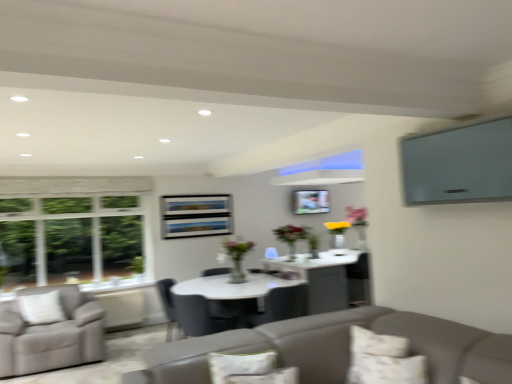
Question: Is fluffy white pillow at lower center, marked as the first pillow in a left-to-right arrangement, wider or thinner than white textured pillow at lower right, the 2th pillow viewed from the left?

Choices:
 (A) thin
 (B) wide

Answer: (A)

Question: Considering the relative positions of fluffy white pillow at lower center, arranged as the 2th pillow when viewed from the right, and white textured pillow at lower right, the 2th pillow viewed from the left, in the image provided, is fluffy white pillow at lower center, arranged as the 2th pillow when viewed from the right, to the left or to the right of white textured pillow at lower right, the 2th pillow viewed from the left,?

Choices:
 (A) right
 (B) left

Answer: (B)

Question: Which object is the farthest from the matte black chair at center, the second chair when ordered from right to left?

Choices:
 (A) fluffy white pillow at lower center, arranged as the 2th pillow when viewed from the right
 (B) white textured pillow at lower right, the 2th pillow viewed from the left
 (C) matte gray chair at center, which ranks as the 1th chair in right-to-left order

Answer: (B)

Question: Which object is positioned farthest from the matte black chair at center, the second chair when ordered from right to left?

Choices:
 (A) matte gray chair at center, which is counted as the second chair, starting from the left
 (B) fluffy white pillow at lower center, marked as the first pillow in a left-to-right arrangement
 (C) white textured pillow at lower right, which is the 1th pillow from right to left

Answer: (C)